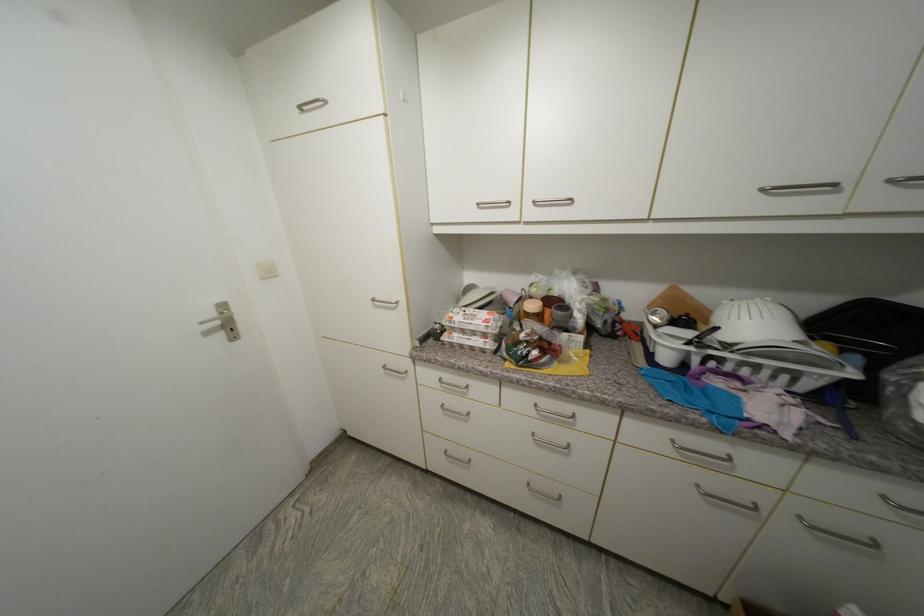
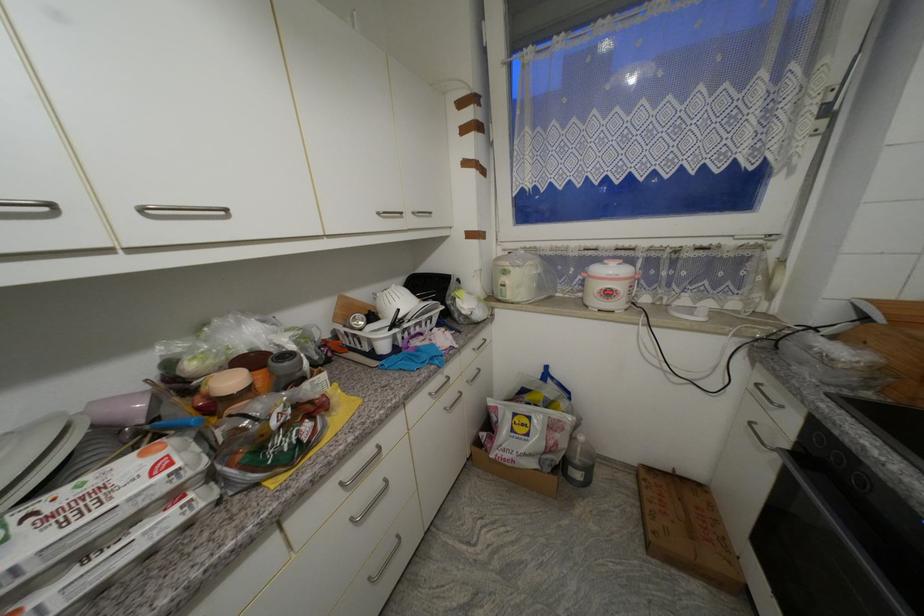
Locate, in the second image, the point that corresponds to (539,436) in the first image.

(358, 521)